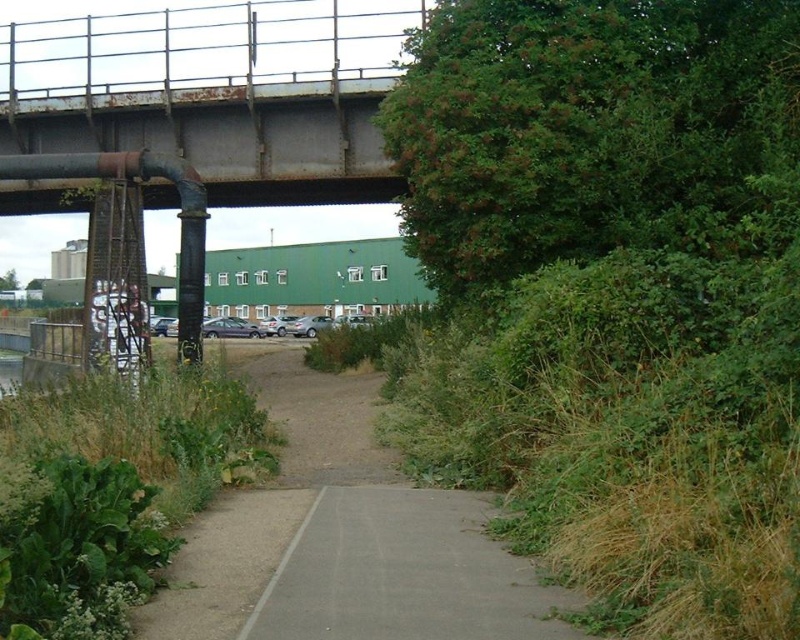
Is green leafy bush at upper right to the right of dull gray concrete path at center from the viewer's perspective?

Correct, you'll find green leafy bush at upper right to the right of dull gray concrete path at center.

Between green leafy bush at upper right and dull gray concrete path at center, which one appears on the left side from the viewer's perspective?

From the viewer's perspective, dull gray concrete path at center appears more on the left side.

Between point (658, 83) and point (280, 468), which one is positioned in front?

Positioned in front is point (280, 468).

The image size is (800, 640). What are the coordinates of `green leafy bush at upper right` in the screenshot? It's located at (617, 291).

Can you confirm if dull gray concrete path at center is positioned to the left of rusty metal bridge at upper center?

In fact, dull gray concrete path at center is to the right of rusty metal bridge at upper center.

Between dull gray concrete path at center and rusty metal bridge at upper center, which one appears on the left side from the viewer's perspective?

Positioned to the left is rusty metal bridge at upper center.

This screenshot has height=640, width=800. What do you see at coordinates (344, 538) in the screenshot?
I see `dull gray concrete path at center` at bounding box center [344, 538].

Image resolution: width=800 pixels, height=640 pixels. I want to click on dull gray concrete path at center, so click(x=344, y=538).

Image resolution: width=800 pixels, height=640 pixels. What do you see at coordinates (617, 291) in the screenshot?
I see `green leafy bush at upper right` at bounding box center [617, 291].

Who is lower down, green leafy bush at upper right or rusty metal bridge at upper center?

Positioned lower is green leafy bush at upper right.

Image resolution: width=800 pixels, height=640 pixels. I want to click on green leafy bush at upper right, so click(x=617, y=291).